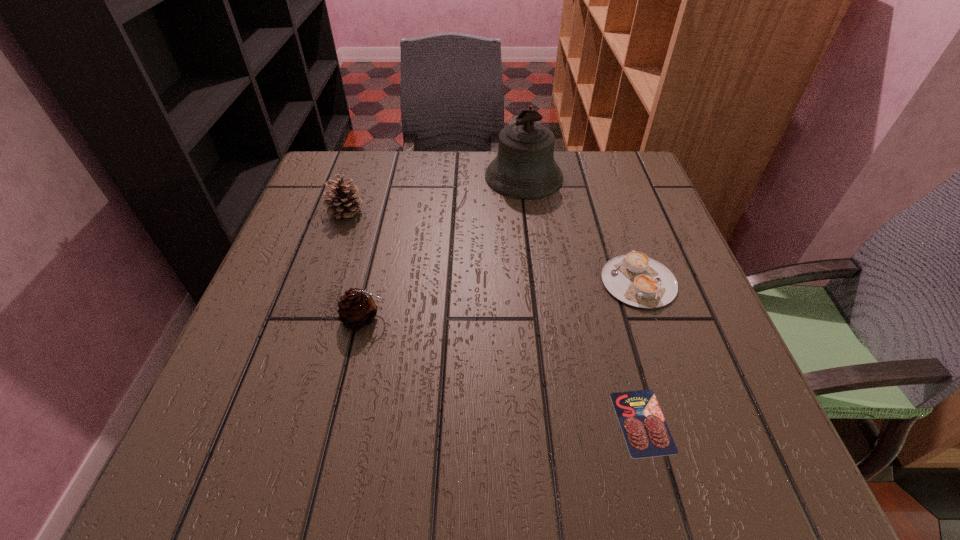
The image size is (960, 540). What are the coordinates of `free space between the fourth tallest object and the right pinecone` in the screenshot? It's located at (501, 300).

Image resolution: width=960 pixels, height=540 pixels. I want to click on vacant point located between the right pinecone and the cappuccino, so click(501, 300).

This screenshot has height=540, width=960. What are the coordinates of `free space between the nearest object and the farthest object` in the screenshot? It's located at (583, 299).

This screenshot has width=960, height=540. I want to click on free space between the bell and the salami, so click(583, 299).

At what (x,y) coordinates should I click in order to perform the action: click on vacant area that lies between the leftmost object and the cappuccino. Please return your answer as a coordinate pair (x, y). Looking at the image, I should click on (492, 246).

Find the location of a particular element. This screenshot has height=540, width=960. free space between the nearer pinecone and the left pinecone is located at coordinates (355, 265).

This screenshot has width=960, height=540. Find the location of `free area in between the fourth tallest object and the nearer pinecone`. free area in between the fourth tallest object and the nearer pinecone is located at coordinates (501, 300).

Find the location of a particular element. This screenshot has width=960, height=540. empty space that is in between the farthest object and the second object from left to right is located at coordinates (444, 247).

This screenshot has height=540, width=960. In order to click on free spot between the leftmost object and the shortest object in this screenshot , I will do pos(494,316).

Locate which object is the second closest to the taller pinecone. Please provide its 2D coordinates. Your answer should be formatted as a tuple, i.e. [(x, y)], where the tuple contains the x and y coordinates of a point satisfying the conditions above.

[(524, 168)]